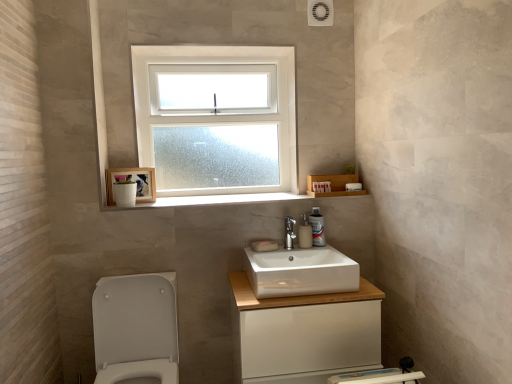
What is the approximate height of white marble window sill at center?

The height of white marble window sill at center is 0.68 inches.

Describe the element at coordinates (289, 233) in the screenshot. Image resolution: width=512 pixels, height=384 pixels. I see `satin nickel faucet at center` at that location.

Image resolution: width=512 pixels, height=384 pixels. I want to click on white glossy toilet at lower left, so click(x=136, y=328).

Locate an element on the screen. white matte soap at center, the 1th soap from the front is located at coordinates (264, 246).

Does white plastic soap dispenser at upper center, the 1th soap dispenser from the right, appear on the left side of white glossy toilet at lower left?

No, white plastic soap dispenser at upper center, the 1th soap dispenser from the right, is not to the left of white glossy toilet at lower left.

Does white plastic soap dispenser at upper center, the 1th soap dispenser from the right, turn towards white glossy toilet at lower left?

No, white plastic soap dispenser at upper center, the 1th soap dispenser from the right, is not oriented towards white glossy toilet at lower left.

From the image's perspective, is white plastic soap dispenser at upper center, the 2th soap dispenser when ordered from left to right, above white glossy toilet at lower left?

Yes, from the image's perspective, white plastic soap dispenser at upper center, the 2th soap dispenser when ordered from left to right, is over white glossy toilet at lower left.

Is white glossy sink at center positioned with its back to clear glass window at upper center?

No, clear glass window at upper center is not at the back of white glossy sink at center.

How many degrees apart are the facing directions of white glossy sink at center and clear glass window at upper center?

The angle between the facing direction of white glossy sink at center and the facing direction of clear glass window at upper center is 0.027 degrees.

You are a GUI agent. You are given a task and a screenshot of the screen. Output one action in this format:
    pyautogui.click(x=<x>, y=<y>)
    Task: Click on the sink on the right of clear glass window at upper center
    This screenshot has width=512, height=384.
    Given the screenshot: What is the action you would take?
    pyautogui.click(x=300, y=271)

Is white glossy sink at center positioned beyond the bounds of clear glass window at upper center?

Yes, white glossy sink at center is located beyond the bounds of clear glass window at upper center.

Is white matte soap at center, the first soap in the back-to-front sequence, inside white glossy toilet at lower left?

Definitely not — white matte soap at center, the first soap in the back-to-front sequence, is not inside white glossy toilet at lower left.

From the image's perspective, count 2nd soaps upward from the white glossy toilet at lower left and point to it. Please provide its 2D coordinates.

[(265, 244)]

Which object is positioned more to the left, white glossy toilet at lower left or white matte soap at center, the first soap in the back-to-front sequence?

white glossy toilet at lower left.

Looking at the image, does white glossy toilet at lower left seem bigger or smaller compared to white matte soap at center, the first soap in the back-to-front sequence?

In the image, white glossy toilet at lower left appears to be larger than white matte soap at center, the first soap in the back-to-front sequence.

Between clear glass window at upper center and white glossy toilet at lower left, which one has larger size?

With larger size is white glossy toilet at lower left.

From the picture: Is clear glass window at upper center next to white glossy toilet at lower left and touching it?

clear glass window at upper center and white glossy toilet at lower left are clearly separated.

From a real-world perspective, is clear glass window at upper center above or below white glossy toilet at lower left?

Clearly, from a real-world perspective, clear glass window at upper center is above white glossy toilet at lower left.

Is white glossy toilet at lower left at the back of clear glass window at upper center?

That's not correct — clear glass window at upper center is not looking away from white glossy toilet at lower left.

Considering the positions of objects translucent plastic soap dispenser at center, marked as the second soap dispenser in a right-to-left arrangement, and white matte toilet paper at upper right in the image provided, who is more to the right, translucent plastic soap dispenser at center, marked as the second soap dispenser in a right-to-left arrangement, or white matte toilet paper at upper right?

white matte toilet paper at upper right is more to the right.

Which is correct: translucent plastic soap dispenser at center, marked as the second soap dispenser in a right-to-left arrangement, is inside white matte toilet paper at upper right, or outside of it?

translucent plastic soap dispenser at center, marked as the second soap dispenser in a right-to-left arrangement, is outside white matte toilet paper at upper right.

Does translucent plastic soap dispenser at center, marked as the second soap dispenser in a right-to-left arrangement, lie behind white matte toilet paper at upper right?

No, translucent plastic soap dispenser at center, marked as the second soap dispenser in a right-to-left arrangement, is in front of white matte toilet paper at upper right.

Find the location of a particular element. This screenshot has width=512, height=384. the 2nd soap dispenser to the left when counting from the white matte toilet paper at upper right is located at coordinates (305, 233).

Is white marble window sill at center located outside white plastic soap dispenser at upper center, the 2th soap dispenser when ordered from left to right?

white marble window sill at center lies outside white plastic soap dispenser at upper center, the 2th soap dispenser when ordered from left to right,'s area.

From a real-world perspective, is white marble window sill at center on top of white plastic soap dispenser at upper center, the 1th soap dispenser from the right?

Yes.

Which of these two, white glossy sink at center or white matte soap at center, the first soap in the back-to-front sequence, is wider?

With larger width is white glossy sink at center.

Is white glossy sink at center further to the viewer compared to white matte soap at center, which is the 2th soap from front to back?

No, it is not.

Are white glossy sink at center and white matte soap at center, which is the 2th soap from front to back, far apart?

No, white glossy sink at center is not far away from white matte soap at center, which is the 2th soap from front to back.

Is white glossy sink at center aimed at white matte soap at center, the first soap in the back-to-front sequence?

No, white glossy sink at center is not aimed at white matte soap at center, the first soap in the back-to-front sequence.

Identify the location of the 2nd soap dispenser above when counting from the white glossy toilet at lower left (from the image's perspective). The width and height of the screenshot is (512, 384). [x=317, y=227].

This screenshot has width=512, height=384. What are the coordinates of `window behind the white glossy sink at center` in the screenshot? It's located at (217, 105).

Estimate the real-world distances between objects in this image. Which object is further from white marble window sill at center, white glossy toilet at lower left or translucent plastic soap dispenser at center, the first soap dispenser from the left?

white glossy toilet at lower left is further to white marble window sill at center.

Based on their spatial positions, is translucent plastic soap dispenser at center, the first soap dispenser from the left, or white glossy cabinet at center further from white glossy sink at center?

The object further to white glossy sink at center is translucent plastic soap dispenser at center, the first soap dispenser from the left.

Which object lies nearer to the anchor point satin nickel faucet at center, white matte toilet paper at upper right or white marble window sill at center?

Based on the image, white marble window sill at center appears to be nearer to satin nickel faucet at center.

Which object lies further to the anchor point white glossy cabinet at center, white matte toilet paper at upper right or satin nickel faucet at center?

The object further to white glossy cabinet at center is white matte toilet paper at upper right.

Looking at the image, which one is located closer to translucent plastic soap dispenser at center, the first soap dispenser from the left, white marble window sill at center or white matte toilet paper at upper right?

white matte toilet paper at upper right lies closer to translucent plastic soap dispenser at center, the first soap dispenser from the left, than the other object.

Based on their spatial positions, is white glossy sink at center or white matte toilet paper at upper right closer to white marble window sill at center?

white glossy sink at center is positioned closer to the anchor white marble window sill at center.

In the scene shown: Which object lies nearer to the anchor point white glossy toilet at lower left, white matte toilet paper at upper right or white plastic soap dispenser at upper center, the 2th soap dispenser when ordered from left to right?

white plastic soap dispenser at upper center, the 2th soap dispenser when ordered from left to right, is closer to white glossy toilet at lower left.

From the image, which object appears to be farther from satin nickel faucet at center, translucent plastic soap dispenser at center, marked as the second soap dispenser in a right-to-left arrangement, or white marble window sill at center?

Among the two, white marble window sill at center is located further to satin nickel faucet at center.

Locate an element on the screen. The height and width of the screenshot is (384, 512). soap dispenser between translucent plastic soap dispenser at center, the first soap dispenser from the left, and white matte toilet paper at upper right from left to right is located at coordinates (317, 227).

Locate an element on the screen. The image size is (512, 384). bathroom cabinet between white glossy toilet at lower left and white matte toilet paper at upper right from left to right is located at coordinates (304, 334).

I want to click on tap located between white glossy toilet at lower left and white matte toilet paper at upper right in the left-right direction, so click(289, 233).

The height and width of the screenshot is (384, 512). In order to click on sink between satin nickel faucet at center and white glossy cabinet at center vertically in this screenshot , I will do `click(300, 271)`.